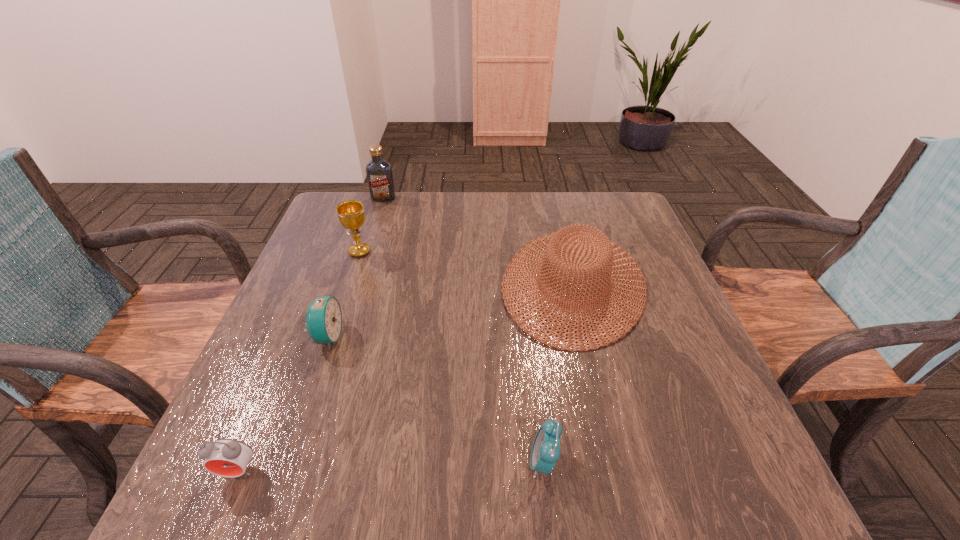
I want to click on vacant region that satisfies the following two spatial constraints: 1. on the front-facing side of the farthest alarm clock; 2. on the face of the leftmost alarm clock, so click(x=281, y=471).